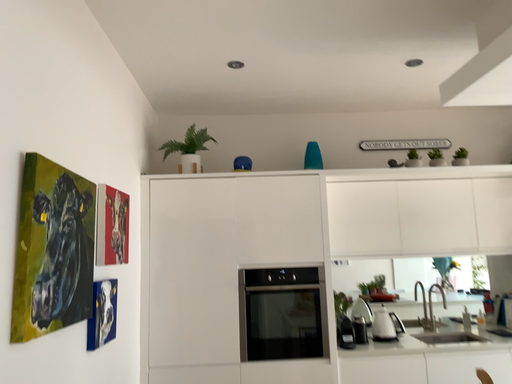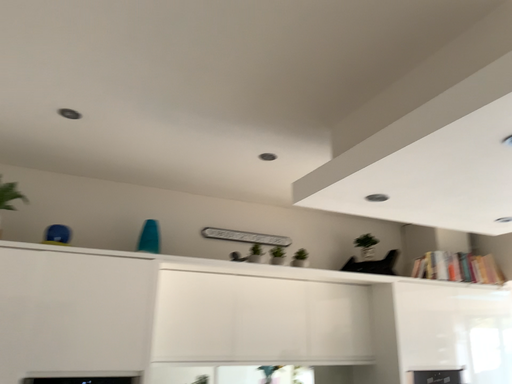
Question: How did the camera likely rotate when shooting the video?

Choices:
 (A) rotated upward
 (B) rotated downward

Answer: (A)